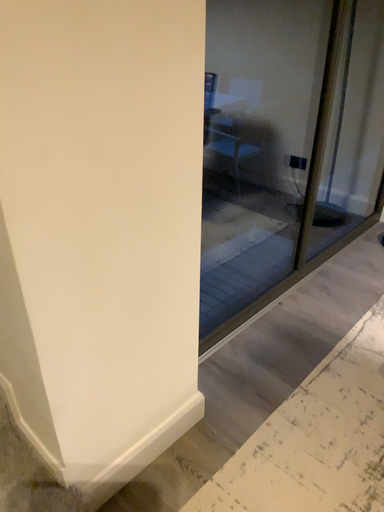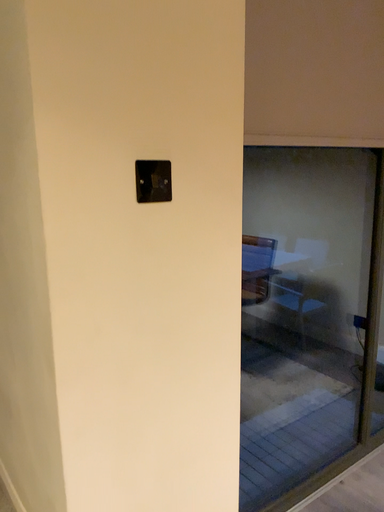
Question: How did the camera likely rotate when shooting the video?

Choices:
 (A) rotated left
 (B) rotated right

Answer: (A)